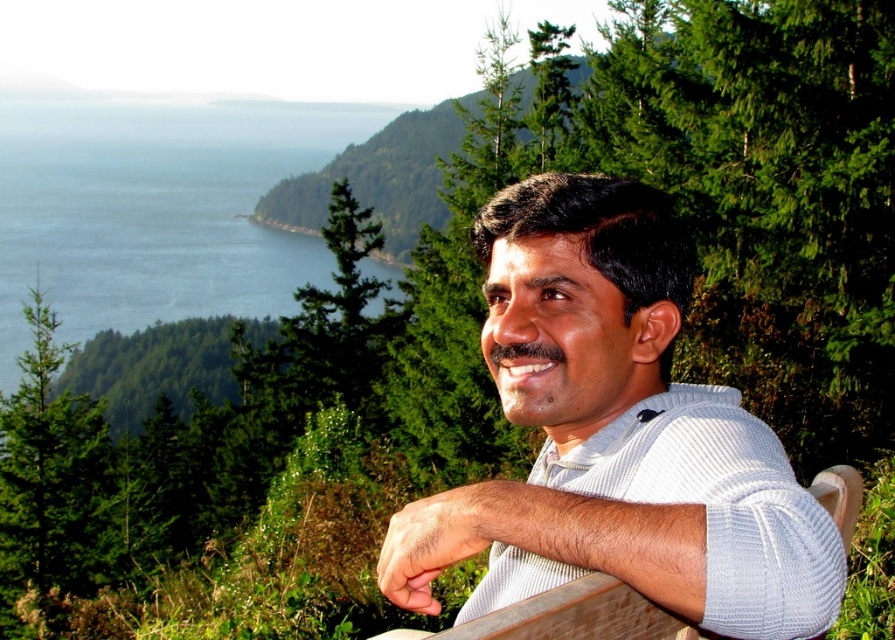
Is white ribbed sweater at center behind blue water at upper left?

No, white ribbed sweater at center is closer to the viewer.

Can you confirm if white ribbed sweater at center is bigger than blue water at upper left?

No, white ribbed sweater at center is not bigger than blue water at upper left.

In order to click on white ribbed sweater at center in this screenshot , I will do `click(616, 435)`.